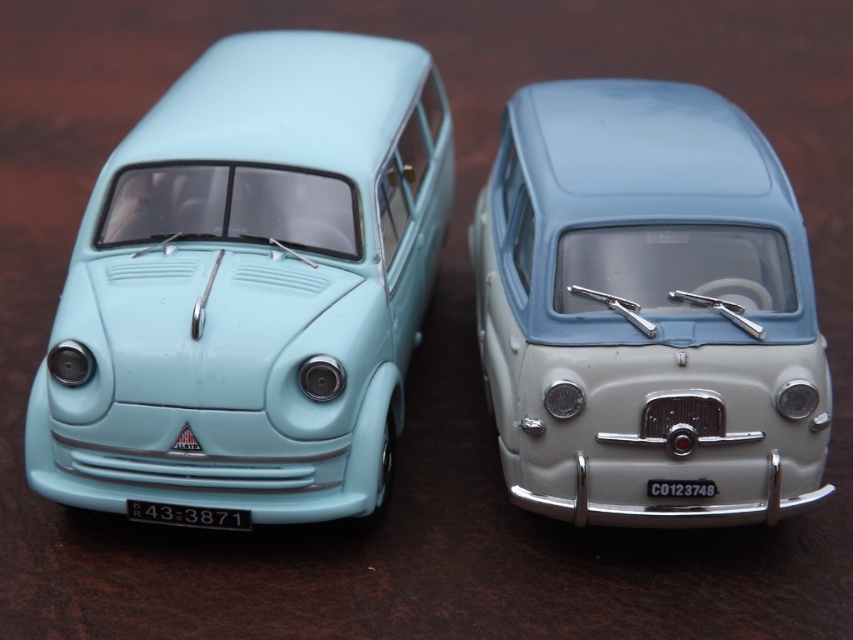
Question: Is matte light blue van at left positioned behind light blue matte van at center?

Choices:
 (A) no
 (B) yes

Answer: (A)

Question: Among these objects, which one is nearest to the camera?

Choices:
 (A) light blue matte van at center
 (B) matte light blue van at left

Answer: (B)

Question: Which point is closer to the camera?

Choices:
 (A) matte light blue van at left
 (B) light blue matte van at center

Answer: (A)

Question: Which point is closer to the camera?

Choices:
 (A) matte light blue van at left
 (B) light blue matte van at center

Answer: (A)

Question: Is matte light blue van at left wider than light blue matte van at center?

Choices:
 (A) yes
 (B) no

Answer: (A)

Question: Is matte light blue van at left bigger than light blue matte van at center?

Choices:
 (A) no
 (B) yes

Answer: (B)